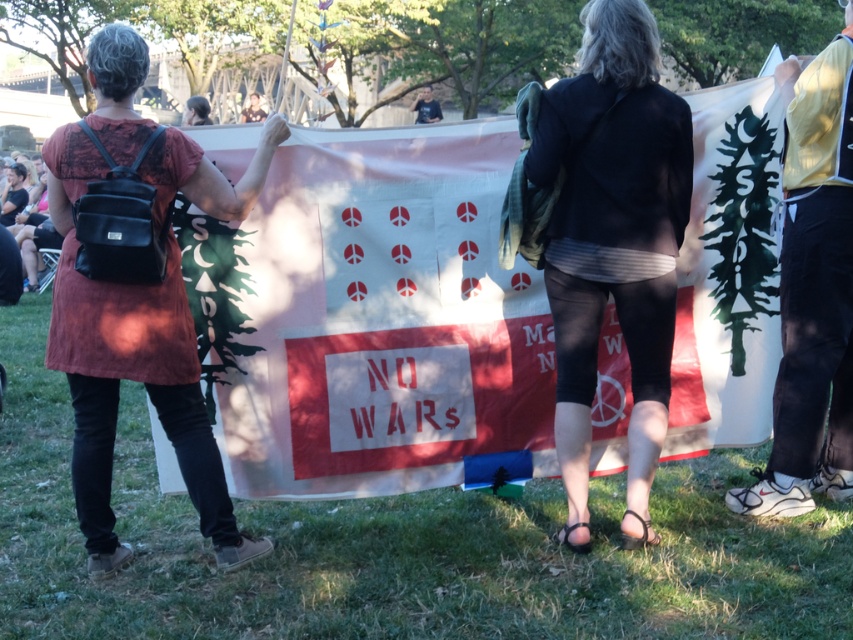
What do you see at coordinates (613, 243) in the screenshot?
I see `black fabric jacket at center` at bounding box center [613, 243].

Describe the element at coordinates (613, 243) in the screenshot. I see `black fabric jacket at center` at that location.

Find the location of `black fabric jacket at center`. black fabric jacket at center is located at coordinates point(613,243).